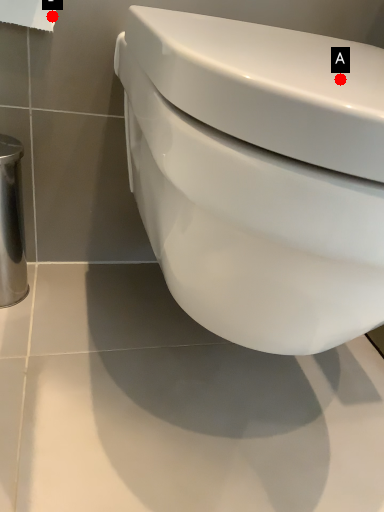
Question: Two points are circled on the image, labeled by A and B beside each circle. Which point appears farthest from the camera in this image?

Choices:
 (A) A is further
 (B) B is further

Answer: (B)